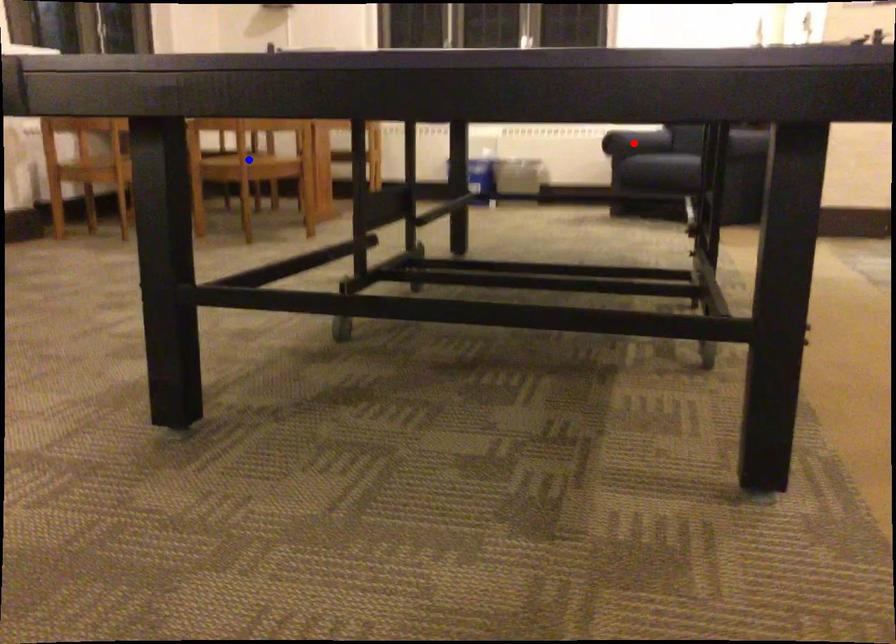
Question: In the image, two points are highlighted. Which point is nearer to the camera? Reply with the corresponding letter.

Choices:
 (A) blue point
 (B) red point

Answer: (A)